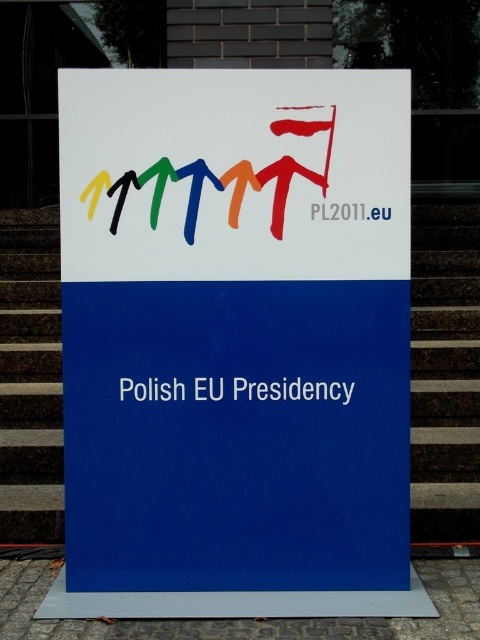
Is white paper sign at center shorter than brown textured stairs at left?

In fact, white paper sign at center may be taller than brown textured stairs at left.

Where is `white paper sign at center`? white paper sign at center is located at coordinates (235, 330).

Locate an element on the screen. white paper sign at center is located at coordinates (235, 330).

Image resolution: width=480 pixels, height=640 pixels. What are the coordinates of `white paper sign at center` in the screenshot? It's located at (235, 330).

Does dark brown wooden stairs at right lie in front of multicolored plastic logo at center?

No, dark brown wooden stairs at right is further to the viewer.

Who is shorter, dark brown wooden stairs at right or multicolored plastic logo at center?

Standing shorter between the two is multicolored plastic logo at center.

Find the location of a particular element. Image resolution: width=480 pixels, height=640 pixels. dark brown wooden stairs at right is located at coordinates (444, 372).

Who is taller, dark brown wooden stairs at right or brown textured stairs at left?

With more height is dark brown wooden stairs at right.

Does dark brown wooden stairs at right appear under brown textured stairs at left?

Incorrect, dark brown wooden stairs at right is not positioned below brown textured stairs at left.

What do you see at coordinates (444, 372) in the screenshot? I see `dark brown wooden stairs at right` at bounding box center [444, 372].

Image resolution: width=480 pixels, height=640 pixels. In order to click on dark brown wooden stairs at right in this screenshot , I will do `click(444, 372)`.